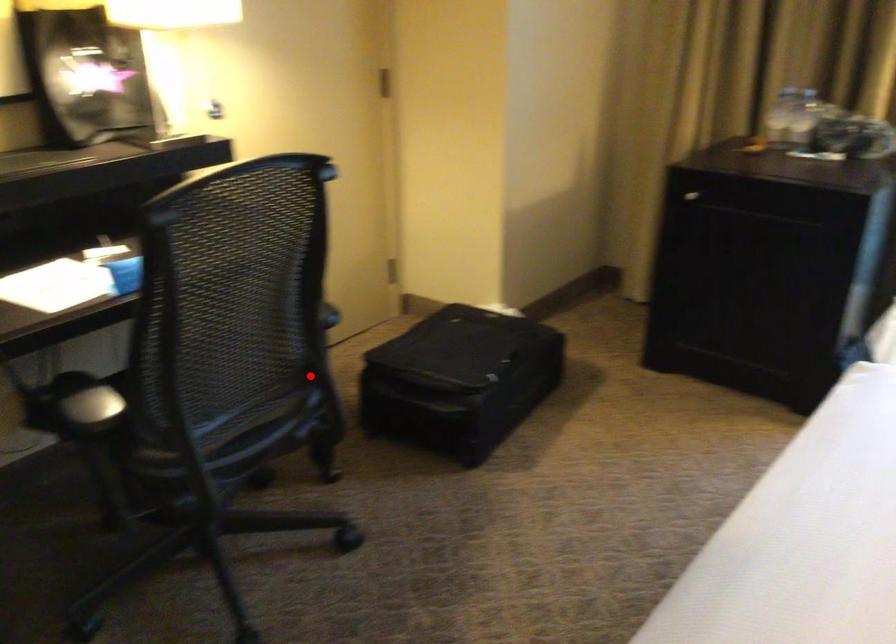
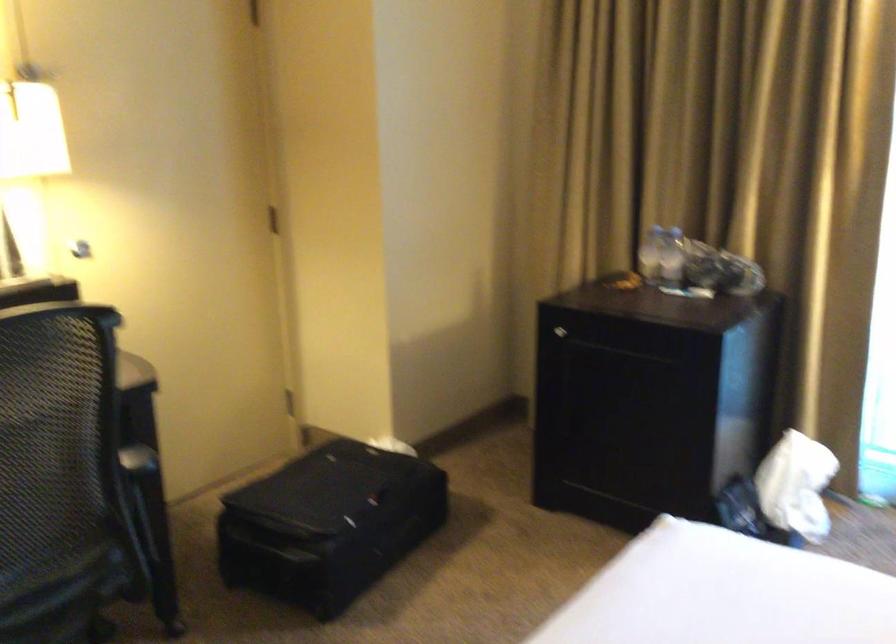
Locate, in the second image, the point that corresponds to the highlighted location in the first image.

(136, 527)